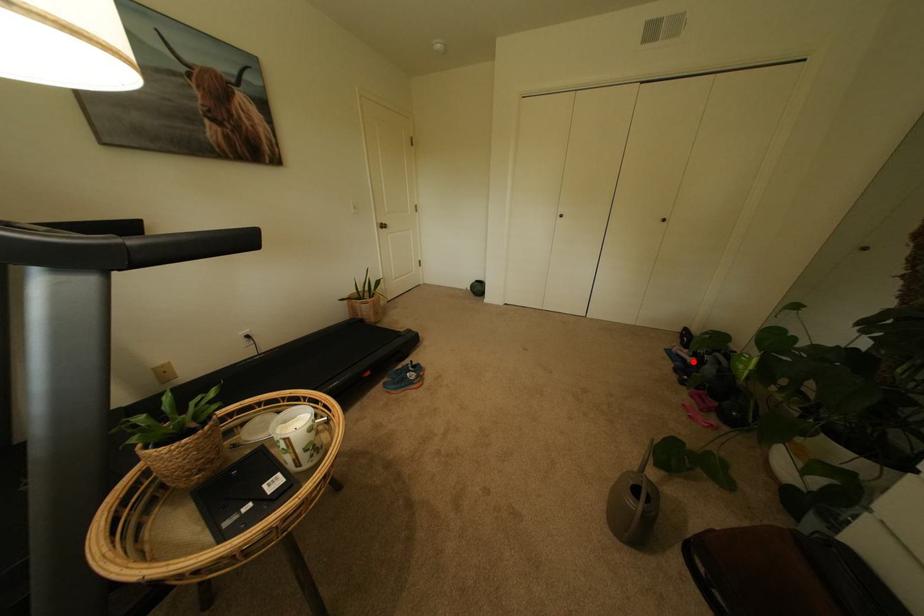
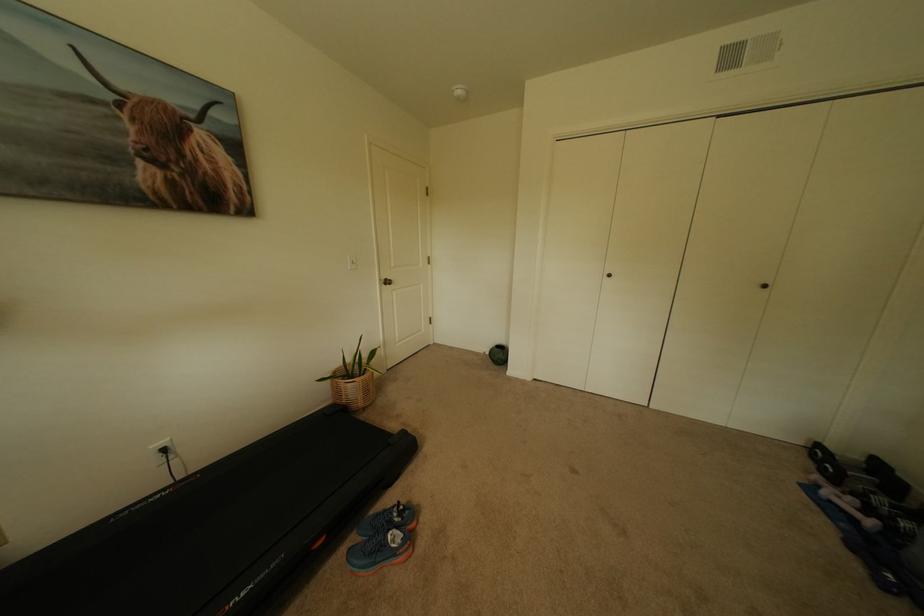
In the second image, find the point that corresponds to the highlighted location in the first image.

(862, 521)